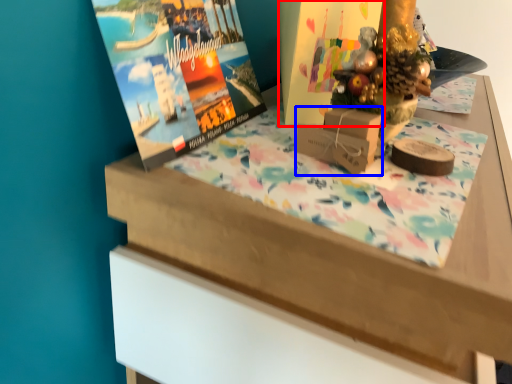
Question: Among these objects, which one is nearest to the camera, book cover (highlighted by a red box) or cardboard box (highlighted by a blue box)?

Choices:
 (A) book cover
 (B) cardboard box

Answer: (B)